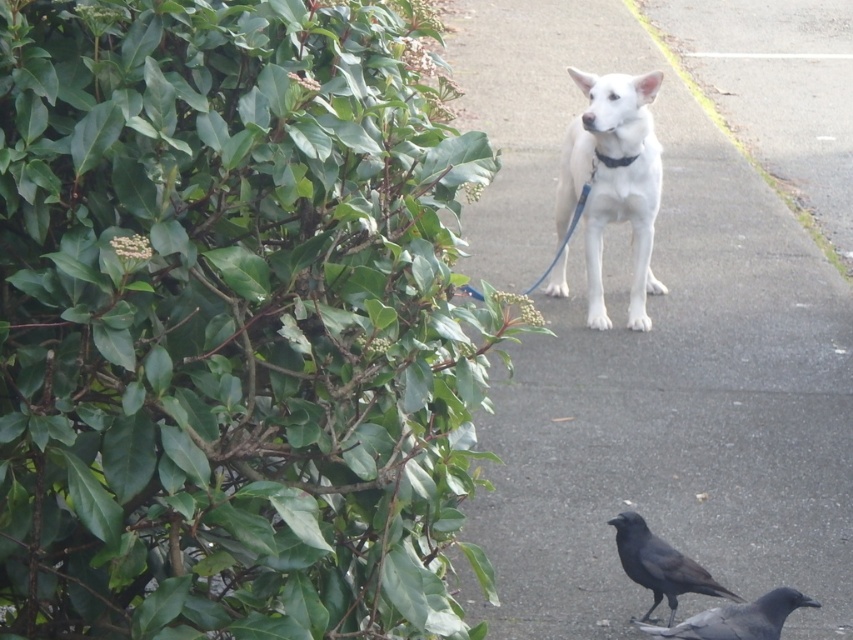
You are standing at the center of the image and want to walk to the smooth concrete sidewalk at center. In which direction should you move?

The smooth concrete sidewalk at center is already at the center of the image, so you are already at the correct location.

You are a photographer trying to capture the white matte dog at center and the gray matte pigeon at lower right in a single shot. Can you focus on both subjects clearly at the same time?

The gray matte pigeon at lower right is behind the white matte dog at center, so focusing on both clearly at the same time may be challenging due to the depth difference between them.